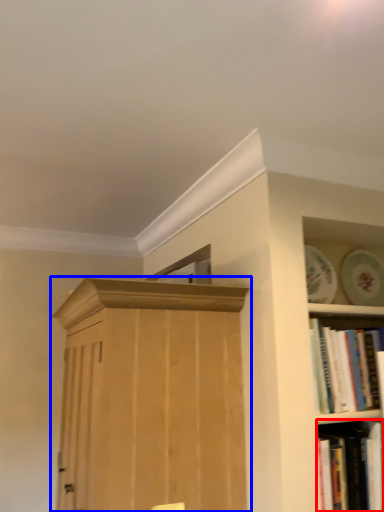
Question: Which object is further to the camera taking this photo, book (highlighted by a red box) or cupboard (highlighted by a blue box)?

Choices:
 (A) book
 (B) cupboard

Answer: (A)